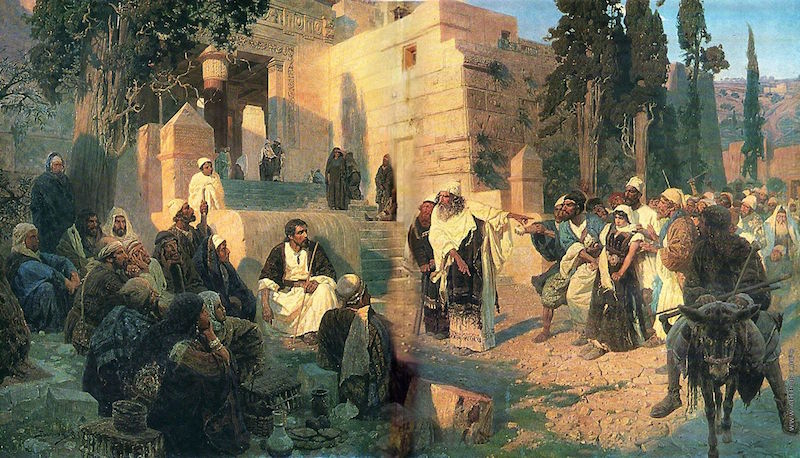
I want to click on stairs, so [x=368, y=240], [x=254, y=189].